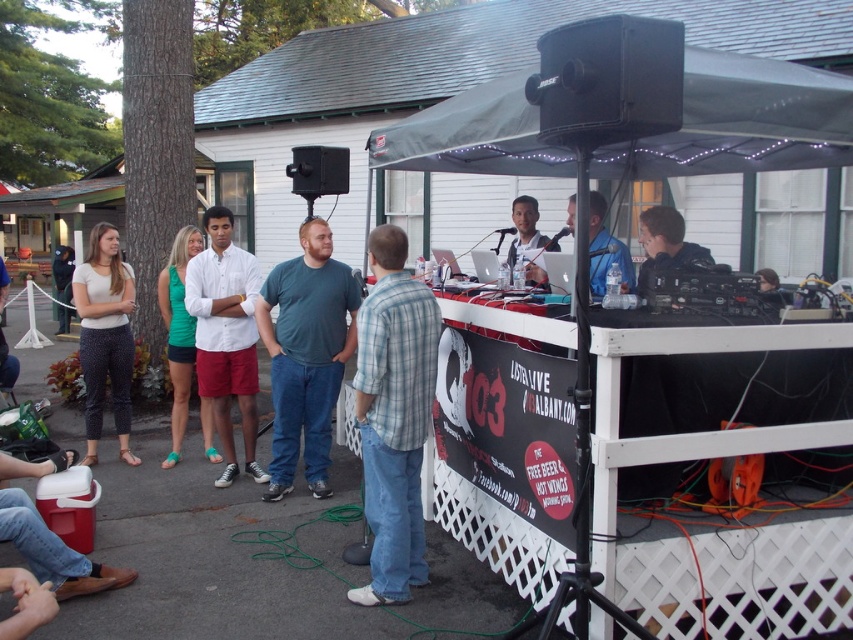
Is point (640, 138) more distant than point (397, 595)?

That is False.

Which is below, dark gray fabric canopy at upper center or blue plaid shirt at center?

blue plaid shirt at center

What do you see at coordinates (741, 122) in the screenshot? Image resolution: width=853 pixels, height=640 pixels. I see `dark gray fabric canopy at upper center` at bounding box center [741, 122].

This screenshot has width=853, height=640. What are the coordinates of `dark gray fabric canopy at upper center` in the screenshot? It's located at (741, 122).

Which of these two, blue plaid shirt at center or black plastic speaker at upper center, stands shorter?

black plastic speaker at upper center is shorter.

The height and width of the screenshot is (640, 853). Identify the location of blue plaid shirt at center. (393, 416).

Is point (378, 243) farther from camera compared to point (332, 182)?

No, it is in front of (332, 182).

I want to click on blue plaid shirt at center, so click(393, 416).

Which of these two, white cotton shirt at center or black plastic speaker at upper center, stands shorter?

With less height is black plastic speaker at upper center.

Is white cotton shirt at center shorter than black plastic speaker at upper center?

No.

Is point (254, 404) closer to viewer compared to point (345, 176)?

Yes, point (254, 404) is in front of point (345, 176).

What are the coordinates of `white cotton shirt at center` in the screenshot? It's located at (225, 337).